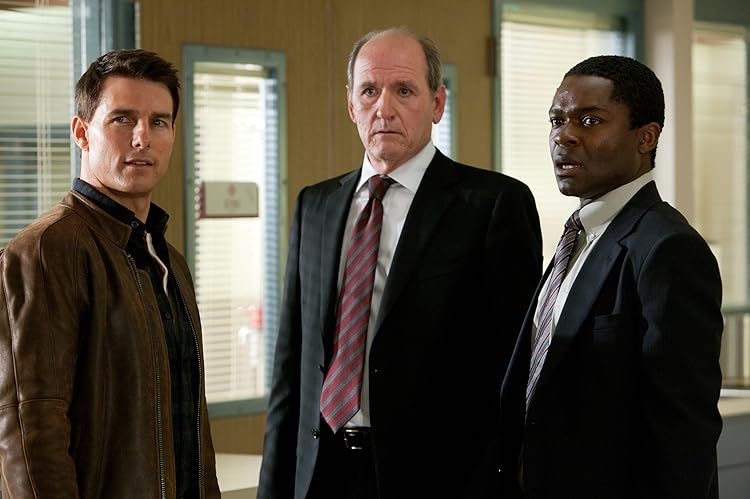
The image size is (750, 499). I want to click on windows, so pos(46,142), pos(231,263), pos(541,58), pos(716,118).